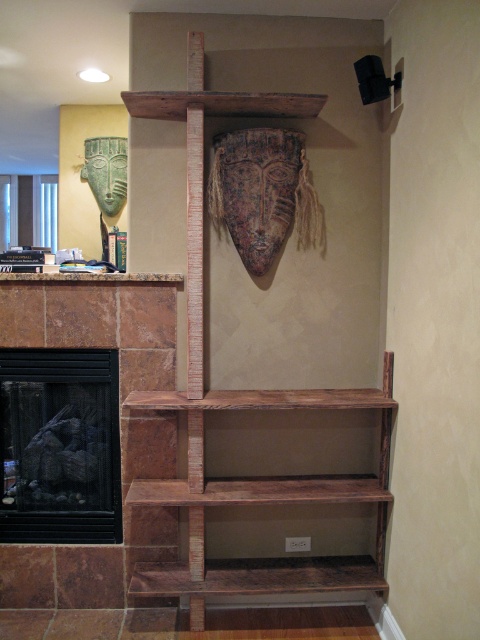
Between rustic wood bookshelf at center and black glass fireplace at left, which one appears on the right side from the viewer's perspective?

Positioned to the right is rustic wood bookshelf at center.

Between point (351, 588) and point (113, 536), which one is positioned behind?

Positioned behind is point (113, 536).

Between point (200, 314) and point (107, 513), which one is positioned behind?

Point (107, 513)

This screenshot has height=640, width=480. I want to click on rustic wood bookshelf at center, so click(247, 401).

Is black glass fireplace at left shorter than brown wood mantle at upper center?

No.

Who is shorter, black glass fireplace at left or brown wood mantle at upper center?

Standing shorter between the two is brown wood mantle at upper center.

Between point (71, 528) and point (156, 275), which one is positioned in front?

Point (156, 275)

The image size is (480, 640). I want to click on black glass fireplace at left, so 60,445.

Between rustic wood bookshelf at center and brown wood mantle at upper center, which one is positioned higher?

brown wood mantle at upper center is higher up.

The height and width of the screenshot is (640, 480). In order to click on rustic wood bookshelf at center in this screenshot , I will do `click(247, 401)`.

Find the location of a particular element. Image resolution: width=480 pixels, height=640 pixels. rustic wood bookshelf at center is located at coordinates (247, 401).

You are a GUI agent. You are given a task and a screenshot of the screen. Output one action in this format:
    pyautogui.click(x=<x>, y=<y>)
    Task: Click on the rustic wood bookshelf at center
    
    Given the screenshot: What is the action you would take?
    pyautogui.click(x=247, y=401)